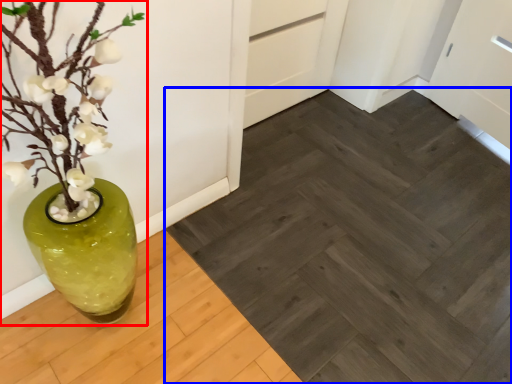
Question: Which point is further to the camera, houseplant (highlighted by a red box) or plank (highlighted by a blue box)?

Choices:
 (A) houseplant
 (B) plank

Answer: (B)